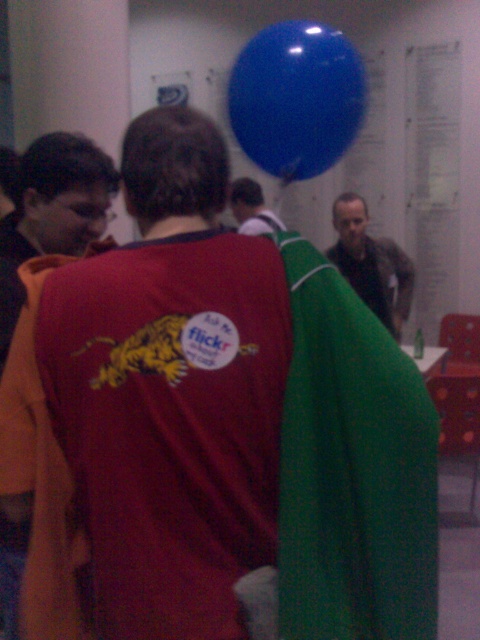
Between point (228, 84) and point (113, 177), which one is positioned behind?

The point (228, 84) is more distant.

Is point (241, 132) closer to viewer compared to point (14, 557)?

No, (241, 132) is behind (14, 557).

Is point (324, 122) more distant than point (6, 262)?

No, (324, 122) is closer to viewer.

Identify the location of glossy blue balloon at upper center. This screenshot has height=640, width=480. (297, 99).

Who is positioned more to the right, glossy blue balloon at upper center or smooth gray shirt at center?

From the viewer's perspective, glossy blue balloon at upper center appears more on the right side.

Which is below, glossy blue balloon at upper center or smooth gray shirt at center?

glossy blue balloon at upper center

Find the location of `glossy blue balloon at upper center`. glossy blue balloon at upper center is located at coordinates (297, 99).

Identify the location of glossy blue balloon at upper center. (297, 99).

Can you confirm if glossy blue balloon at upper center is positioned below matte brown jacket at center?

No.

Can you confirm if glossy blue balloon at upper center is thinner than matte brown jacket at center?

Yes, glossy blue balloon at upper center is thinner than matte brown jacket at center.

Between point (315, 45) and point (368, 243), which one is positioned behind?

The point (368, 243) is more distant.

Identify the location of glossy blue balloon at upper center. This screenshot has height=640, width=480. (297, 99).